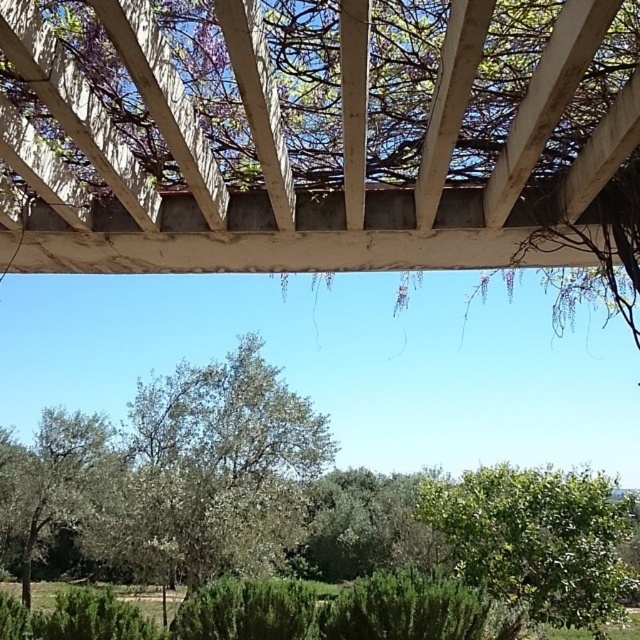
You are a gardener planning to prune the trees in the garden. Which tree, the green leafy tree at center or the green leafy tree at lower right, requires more attention to prevent overgrowth?

The green leafy tree at lower right requires more attention because it is thicker than the green leafy tree at center, indicating potential overgrowth that needs pruning.